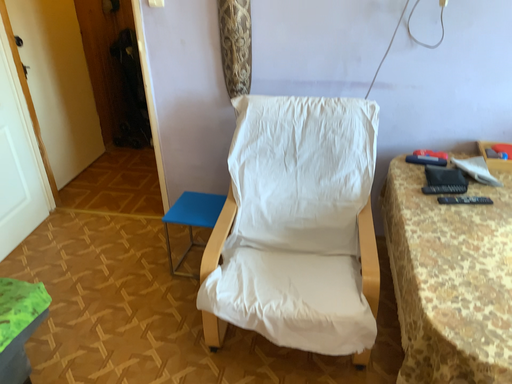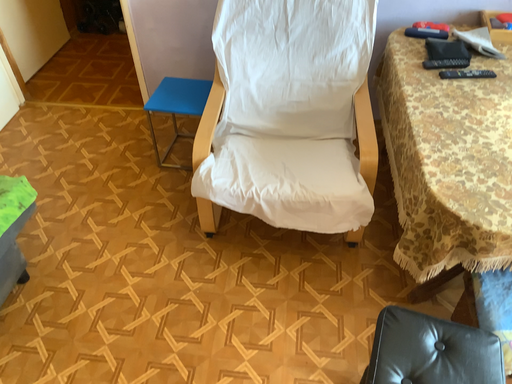
Question: How did the camera likely rotate when shooting the video?

Choices:
 (A) rotated downward
 (B) rotated upward

Answer: (A)